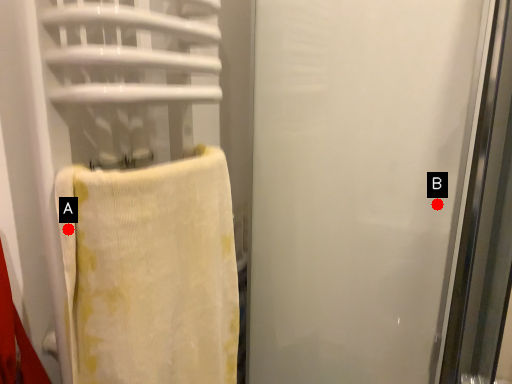
Question: Two points are circled on the image, labeled by A and B beside each circle. Which point is farther from the camera taking this photo?

Choices:
 (A) A is further
 (B) B is further

Answer: (B)